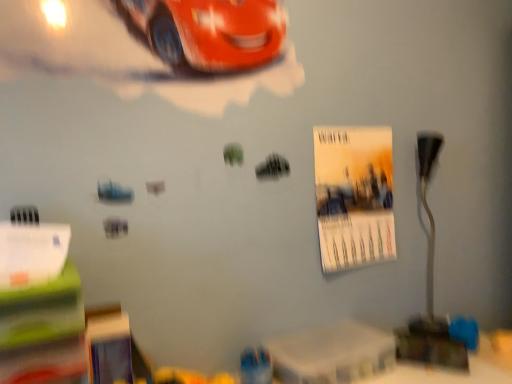
Question: In terms of height, does metallic silver table lamp at right look taller or shorter compared to white plastic table at lower center?

Choices:
 (A) short
 (B) tall

Answer: (B)

Question: Is metallic silver table lamp at right in front of or behind white plastic table at lower center in the image?

Choices:
 (A) front
 (B) behind

Answer: (B)

Question: Which object is positioned farthest from the white plastic table at lower center?

Choices:
 (A) metallic silver table lamp at right
 (B) matte paper poster at center right

Answer: (A)

Question: Estimate the real-world distances between objects in this image. Which object is farther from the white plastic table at lower center?

Choices:
 (A) matte paper poster at center right
 (B) metallic silver table lamp at right

Answer: (B)